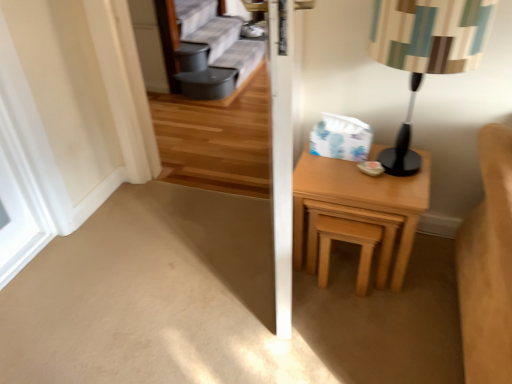
Question: From a real-world perspective, is light wood/texture nightstand at right positioned above or below white matte window at left?

Choices:
 (A) below
 (B) above

Answer: (A)

Question: Choose the correct answer: Is light wood/texture nightstand at right inside white matte window at left or outside it?

Choices:
 (A) outside
 (B) inside

Answer: (A)

Question: Considering the real-world distances, which object is closest to the striped fabric lampshade at right?

Choices:
 (A) light wood/texture nightstand at right
 (B) light brown wooden stool at right
 (C) white matte window at left

Answer: (A)

Question: Estimate the real-world distances between objects in this image. Which object is farther from the striped fabric lampshade at right?

Choices:
 (A) light brown wooden stool at right
 (B) light wood/texture nightstand at right
 (C) white matte window at left

Answer: (C)